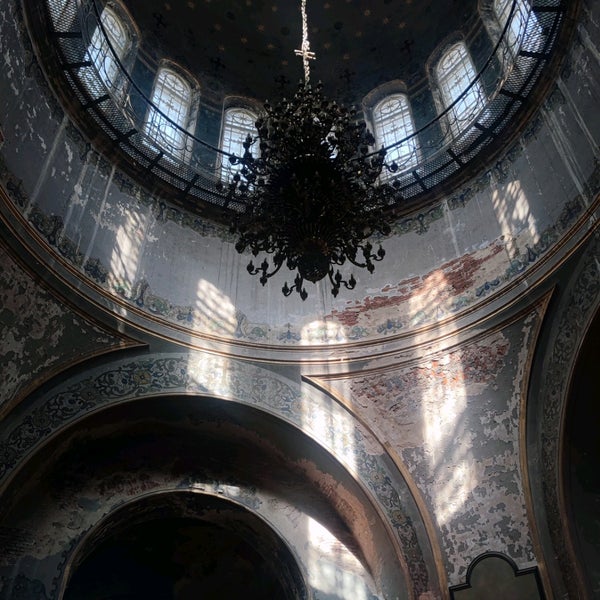
You are a GUI agent. You are given a task and a screenshot of the screen. Output one action in this format:
    pyautogui.click(x=<x>, y=<y>)
    Task: Click on the old paint
    
    Given the screenshot: What is the action you would take?
    pyautogui.click(x=346, y=314), pyautogui.click(x=394, y=299)